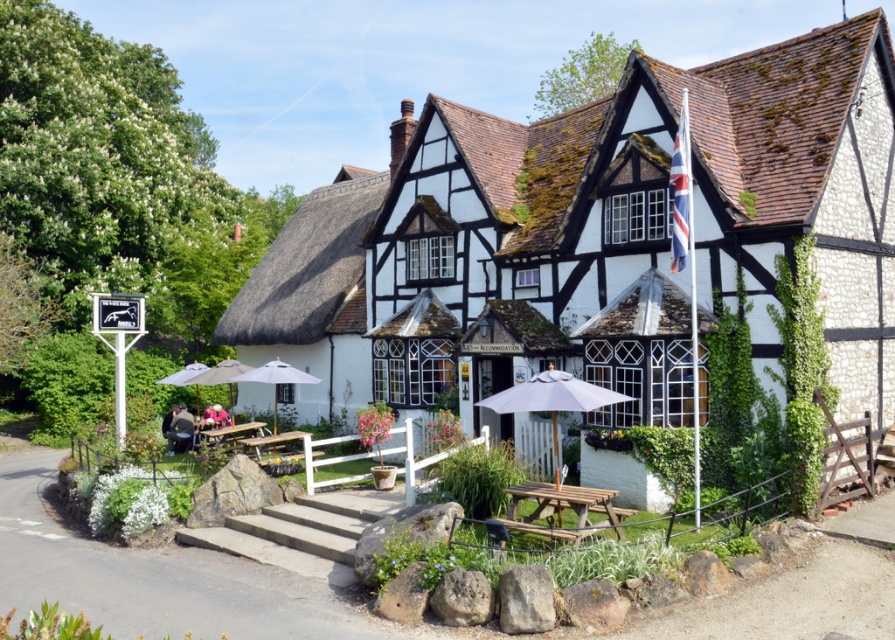
Question: Where is white fabric umbrella at center located in relation to wooden picnic table at lower left in the image?

Choices:
 (A) above
 (B) below

Answer: (A)

Question: Which object is positioned farthest from the white stone cottage at center?

Choices:
 (A) wooden picnic table at lower center
 (B) white fabric umbrella at center
 (C) wooden picnic table at lower left
 (D) matte white umbrella at center

Answer: (C)

Question: Which of the following is the farthest from the observer?

Choices:
 (A) wooden picnic table at lower left
 (B) white fabric umbrella at lower left
 (C) white stone cottage at center
 (D) wooden picnic table at lower center

Answer: (B)

Question: Among these objects, which one is farthest from the camera?

Choices:
 (A) white fabric umbrella at center
 (B) white stone cottage at center

Answer: (A)

Question: Does matte white umbrella at center appear on the left side of white fabric umbrella at lower left?

Choices:
 (A) yes
 (B) no

Answer: (B)

Question: Can you confirm if wooden picnic table at lower center is wider than matte white umbrella at center?

Choices:
 (A) no
 (B) yes

Answer: (A)